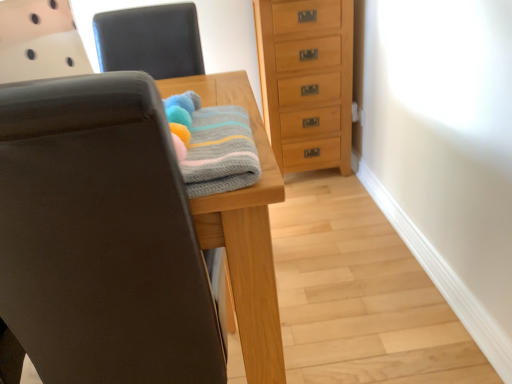
Question: Does light brown wood chest of drawers at center right turn towards matte black chair at left, placed as the first chair when sorted from bottom to top?

Choices:
 (A) yes
 (B) no

Answer: (B)

Question: Is light brown wood chest of drawers at center right next to matte black chair at left, arranged as the 2th chair when viewed from the top?

Choices:
 (A) no
 (B) yes

Answer: (A)

Question: Is matte black chair at left, placed as the first chair when sorted from bottom to top, located within light brown wood chest of drawers at center right?

Choices:
 (A) yes
 (B) no

Answer: (B)

Question: Does light brown wood chest of drawers at center right lie behind matte black chair at left, arranged as the 2th chair when viewed from the top?

Choices:
 (A) yes
 (B) no

Answer: (A)

Question: Does light brown wood chest of drawers at center right have a greater height compared to matte black chair at left, placed as the first chair when sorted from bottom to top?

Choices:
 (A) yes
 (B) no

Answer: (B)

Question: Is light brown wood chest of drawers at center right not near matte black chair at left, arranged as the 2th chair when viewed from the top?

Choices:
 (A) no
 (B) yes

Answer: (B)

Question: Is leather-like black chair at upper center, which appears as the second chair when ordered from the bottom, positioned with its back to knitted cotton towel at center?

Choices:
 (A) yes
 (B) no

Answer: (B)

Question: Does leather-like black chair at upper center, which appears as the 1th chair when viewed from the top, appear on the left side of knitted cotton towel at center?

Choices:
 (A) no
 (B) yes

Answer: (B)

Question: Is leather-like black chair at upper center, which appears as the 1th chair when viewed from the top, to the right of knitted cotton towel at center from the viewer's perspective?

Choices:
 (A) yes
 (B) no

Answer: (B)

Question: Is leather-like black chair at upper center, which appears as the second chair when ordered from the bottom, wider than knitted cotton towel at center?

Choices:
 (A) no
 (B) yes

Answer: (A)

Question: Can you confirm if leather-like black chair at upper center, which appears as the 1th chair when viewed from the top, is bigger than knitted cotton towel at center?

Choices:
 (A) yes
 (B) no

Answer: (A)

Question: Does knitted cotton towel at center have a larger size compared to leather-like black chair at upper center, which appears as the second chair when ordered from the bottom?

Choices:
 (A) no
 (B) yes

Answer: (A)